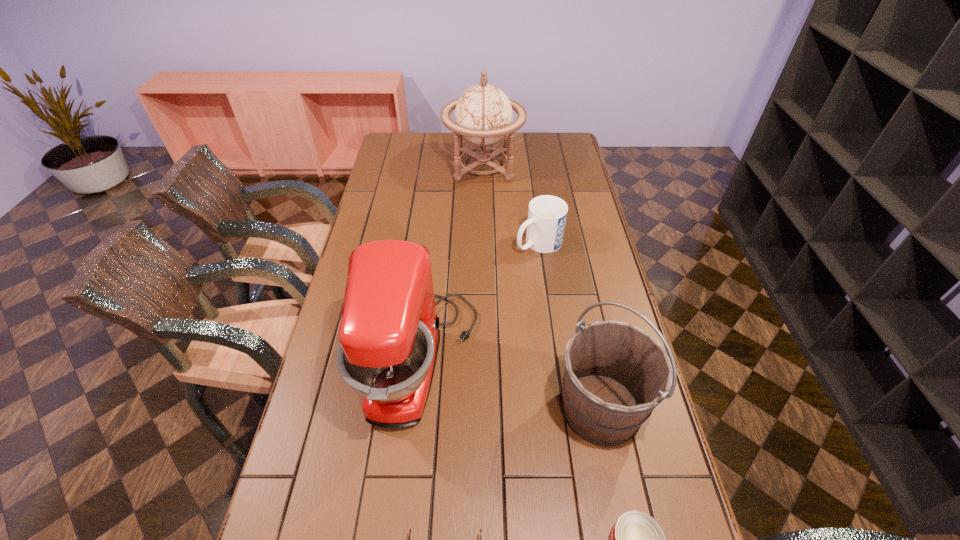
Locate an element on the screen. The height and width of the screenshot is (540, 960). the farthest object is located at coordinates (x=483, y=114).

Locate an element on the screen. The width and height of the screenshot is (960, 540). kitchen mixer is located at coordinates (389, 334).

Image resolution: width=960 pixels, height=540 pixels. Identify the location of bucket. (615, 374).

What are the coordinates of `the fifth nearest object` in the screenshot? It's located at (547, 214).

Locate an element on the screen. free space located 0.130m at the front of the farthest object showing Africa is located at coordinates (415, 166).

Locate an element on the screen. The image size is (960, 540). vacant space located 0.150m at the front of the farthest object showing Africa is located at coordinates (410, 166).

The image size is (960, 540). Identify the location of vacant space located at the front of the farthest object showing Africa. (378, 166).

What are the coordinates of `vacant space located 0.370m on the front-facing side of the kitchen mixer` in the screenshot? It's located at (608, 361).

The width and height of the screenshot is (960, 540). Identify the location of free space located on the left of the bucket. (519, 408).

At what (x,y) coordinates should I click in order to perform the action: click on vacant space located on the left of the mug. Please return your answer as a coordinate pair (x, y). Looking at the image, I should click on (415, 243).